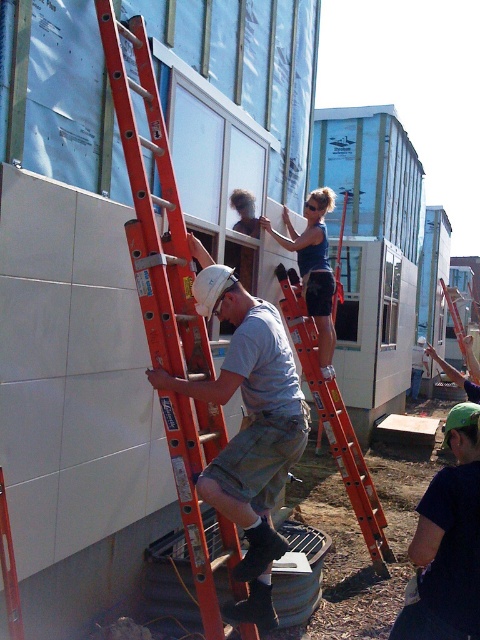
Question: Estimate the real-world distances between objects in this image. Which object is farther from the orange fiberglass ladder at left?

Choices:
 (A) white matte hard hat at center
 (B) matte blue tank top at upper center
 (C) orange fiberglass ladder at center

Answer: (B)

Question: Which point is closer to the camera?

Choices:
 (A) (371, 500)
 (B) (122, 102)
 (C) (250, 396)

Answer: (B)

Question: Does orange fiberglass ladder at left appear under matte blue tank top at upper center?

Choices:
 (A) yes
 (B) no

Answer: (A)

Question: Is white matte hard hat at center smaller than orange fiberglass ladder at center?

Choices:
 (A) yes
 (B) no

Answer: (A)

Question: Can you confirm if orange fiberglass ladder at left is positioned to the left of orange fiberglass ladder at center?

Choices:
 (A) yes
 (B) no

Answer: (A)

Question: Which of the following is the farthest from the observer?

Choices:
 (A) (326, 212)
 (B) (307, 369)
 (C) (248, 477)
 (D) (167, 440)

Answer: (A)